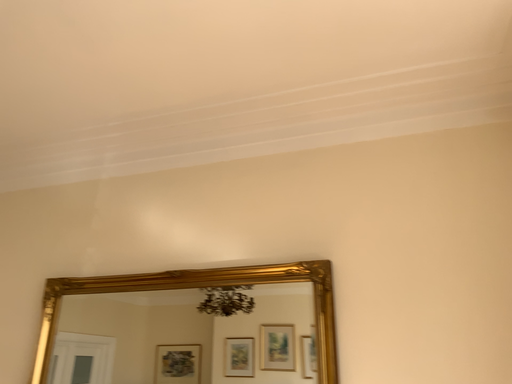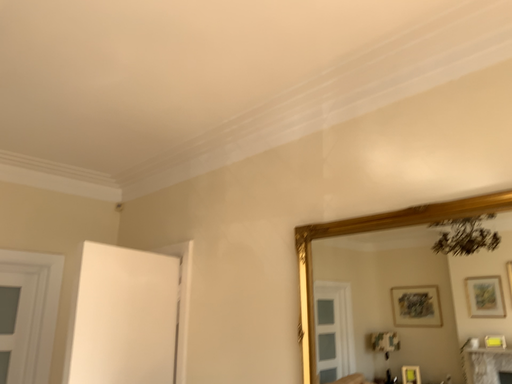
Question: How did the camera likely rotate when shooting the video?

Choices:
 (A) rotated left
 (B) rotated right

Answer: (A)